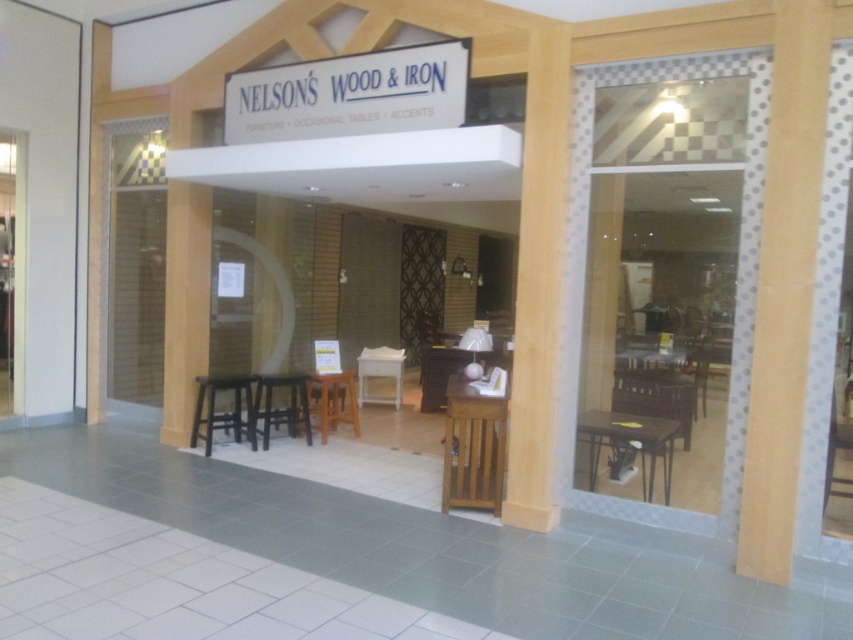
You are a delivery person trying to bring a large wooden crate into the store. The crate is 1.2 meters wide. You see the matte white door at left and the white wood table at center. Can the crate pass through the door?

The matte white door at left has a lesser width compared to white wood table at center. Since the table is wider than the door, the crate which is 1.2 meters wide may not fit through the door. You should check the door width or find another entrance.